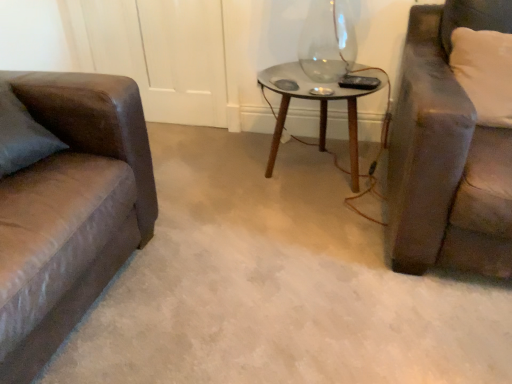
What is the approximate width of white fabric pillow at right?

The width of white fabric pillow at right is 9.20 inches.

The image size is (512, 384). Describe the element at coordinates (484, 73) in the screenshot. I see `white fabric pillow at right` at that location.

Locate an element on the screen. white fabric pillow at right is located at coordinates (484, 73).

Where is `clear glass table at center`? This screenshot has height=384, width=512. clear glass table at center is located at coordinates (321, 106).

What do you see at coordinates (321, 106) in the screenshot? I see `clear glass table at center` at bounding box center [321, 106].

The image size is (512, 384). Find the location of `white fabric pillow at right`. white fabric pillow at right is located at coordinates (484, 73).

Looking at this image, is clear glass table at center to the right of white fabric pillow at right from the viewer's perspective?

In fact, clear glass table at center is to the left of white fabric pillow at right.

Which is behind, clear glass table at center or white fabric pillow at right?

clear glass table at center is further from the camera.

Which is closer, (387, 110) or (479, 101)?

The point (479, 101) is closer to the camera.

From the image's perspective, who appears lower, clear glass table at center or white fabric pillow at right?

clear glass table at center.

From a real-world perspective, between clear glass table at center and white fabric pillow at right, who is vertically higher?

white fabric pillow at right is physically above.

In the scene shown: Between clear glass table at center and white fabric pillow at right, which one has smaller width?

Thinner between the two is white fabric pillow at right.

Considering the sizes of clear glass table at center and white fabric pillow at right in the image, is clear glass table at center taller or shorter than white fabric pillow at right?

Considering their sizes, clear glass table at center has more height than white fabric pillow at right.

Can you confirm if clear glass table at center is smaller than white fabric pillow at right?

No.

Choose the correct answer: Is clear glass table at center inside white fabric pillow at right or outside it?

clear glass table at center is outside white fabric pillow at right.

Is there a large distance between clear glass table at center and white fabric pillow at right?

They are positioned close to each other.

Is clear glass table at center oriented towards white fabric pillow at right?

No, clear glass table at center is not turned towards white fabric pillow at right.

How distant is clear glass table at center from white fabric pillow at right?

21.96 inches.

Where is `pillow that appears above the clear glass table at center (from a real-world perspective)`? pillow that appears above the clear glass table at center (from a real-world perspective) is located at coordinates (484, 73).

Consider the image. Which object is positioned more to the right, white fabric pillow at right or clear glass table at center?

white fabric pillow at right is more to the right.

Consider the image. Is white fabric pillow at right further to the viewer compared to clear glass table at center?

No, white fabric pillow at right is closer to the viewer.

Considering the positions of point (471, 33) and point (355, 156), is point (471, 33) closer or farther from the camera than point (355, 156)?

Point (471, 33).

From the image's perspective, is white fabric pillow at right above or below clear glass table at center?

From the image's perspective, white fabric pillow at right appears above clear glass table at center.

From a real-world perspective, is white fabric pillow at right over clear glass table at center?

Yes, from a real-world perspective, white fabric pillow at right is above clear glass table at center.

Looking at their sizes, would you say white fabric pillow at right is wider or thinner than clear glass table at center?

Considering their sizes, white fabric pillow at right looks slimmer than clear glass table at center.

Is white fabric pillow at right shorter than clear glass table at center?

Correct, white fabric pillow at right is not as tall as clear glass table at center.

Which of these two, white fabric pillow at right or clear glass table at center, is bigger?

clear glass table at center.

Based on the photo, would you say white fabric pillow at right is inside or outside clear glass table at center?

white fabric pillow at right is not enclosed by clear glass table at center.

Would you consider white fabric pillow at right to be distant from clear glass table at center?

That's not correct — white fabric pillow at right is a little close to clear glass table at center.

Could you tell me if white fabric pillow at right is facing clear glass table at center?

No, white fabric pillow at right is not turned towards clear glass table at center.

Identify the location of table that is on the left side of white fabric pillow at right. This screenshot has height=384, width=512. (321, 106).

What are the coordinates of `table that is on the left side of white fabric pillow at right` in the screenshot? It's located at (321, 106).

Find the location of a particular element. Image resolution: width=512 pixels, height=384 pixels. table that appears below the white fabric pillow at right (from a real-world perspective) is located at coordinates (321, 106).